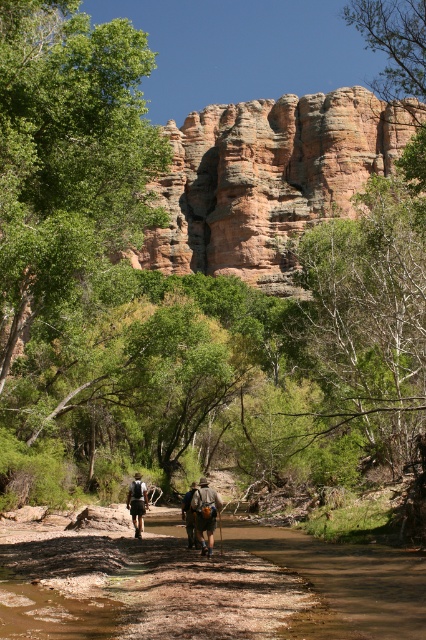
Question: Does matte black backpack at center have a larger size compared to dark brown leather backpack at center?

Choices:
 (A) yes
 (B) no

Answer: (B)

Question: Is rustic sandstone cliff at center thinner than matte black backpack at center?

Choices:
 (A) no
 (B) yes

Answer: (A)

Question: Observing the image, what is the correct spatial positioning of rustic sandstone cliff at center in reference to dark brown leather backpack at center?

Choices:
 (A) above
 (B) below

Answer: (A)

Question: Among these points, which one is farthest from the camera?

Choices:
 (A) (204, 496)
 (B) (218, 188)
 (C) (195, 545)
 (D) (144, 492)

Answer: (B)

Question: Which is farther from the matte black backpack at center?

Choices:
 (A) dark brown leather backpack at center
 (B) rustic sandstone cliff at center
 (C) brown leather horse at center

Answer: (B)

Question: Which point is closer to the camera taking this photo?

Choices:
 (A) (138, 516)
 (B) (203, 552)
 (C) (422, 108)

Answer: (B)